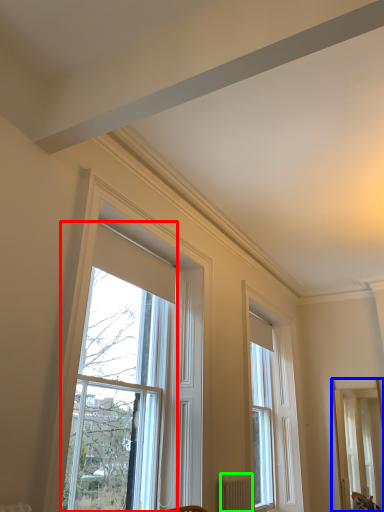
Question: Which object is positioned farthest from window (highlighted by a red box)? Select from mirror (highlighted by a blue box) and radiator (highlighted by a green box).

Choices:
 (A) mirror
 (B) radiator

Answer: (A)